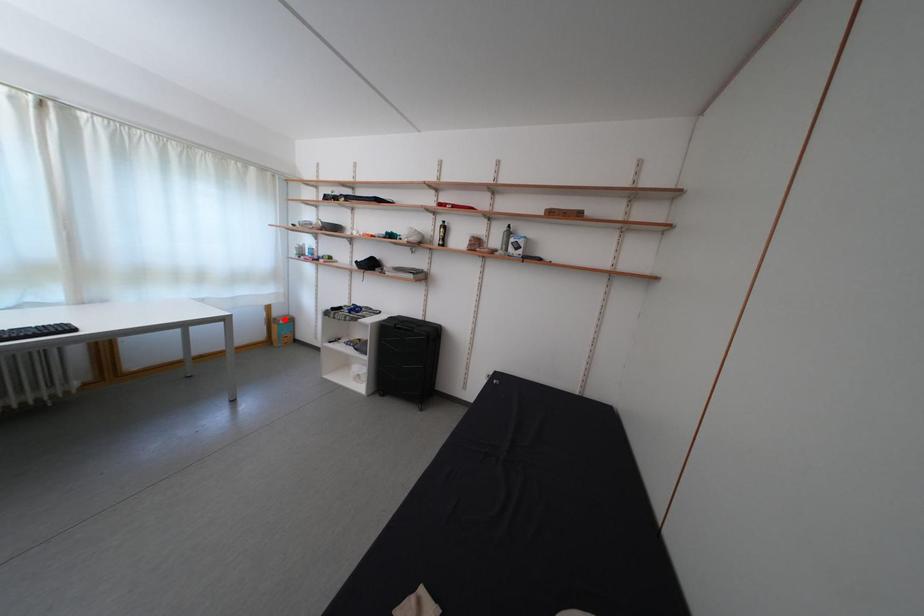
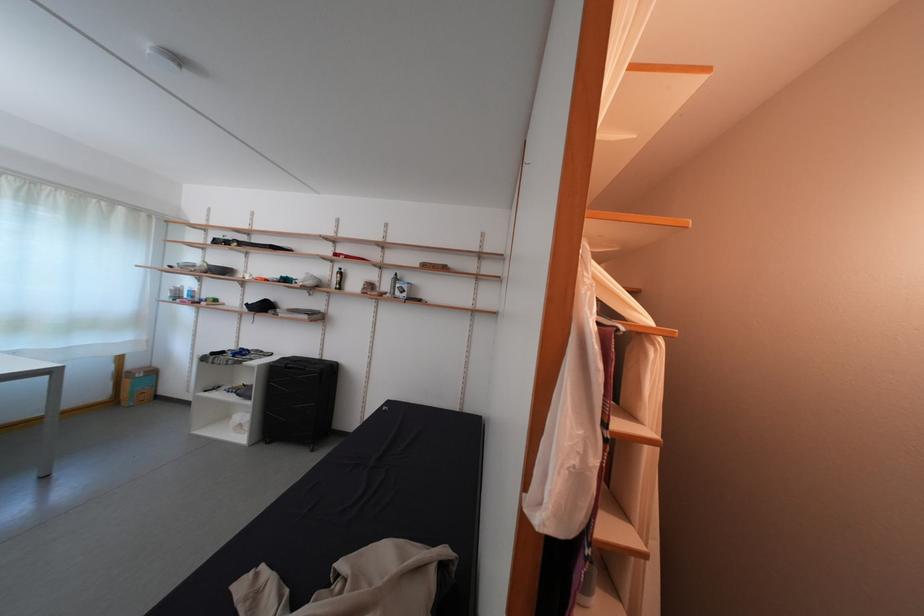
In the second image, find the point that corresponds to the highlighted location in the first image.

(140, 371)